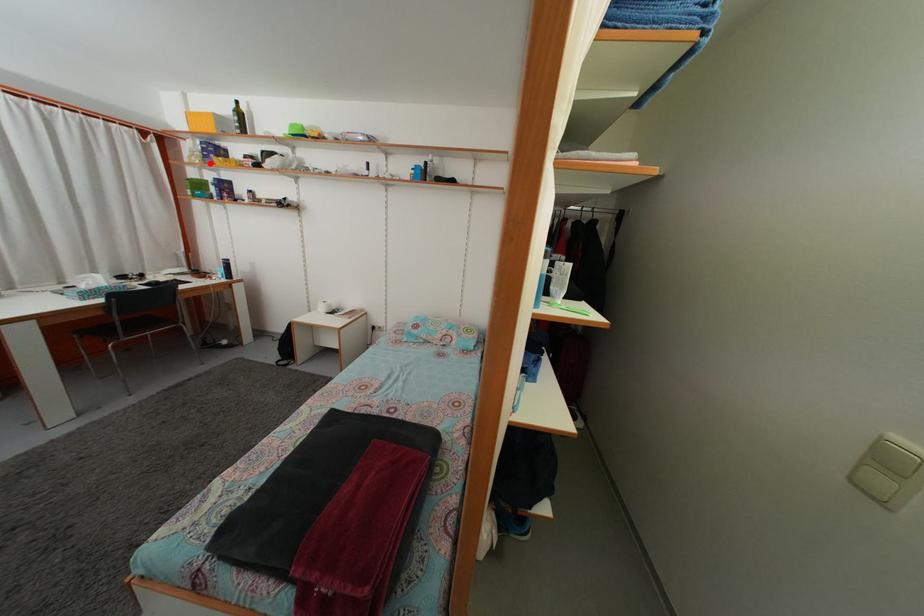
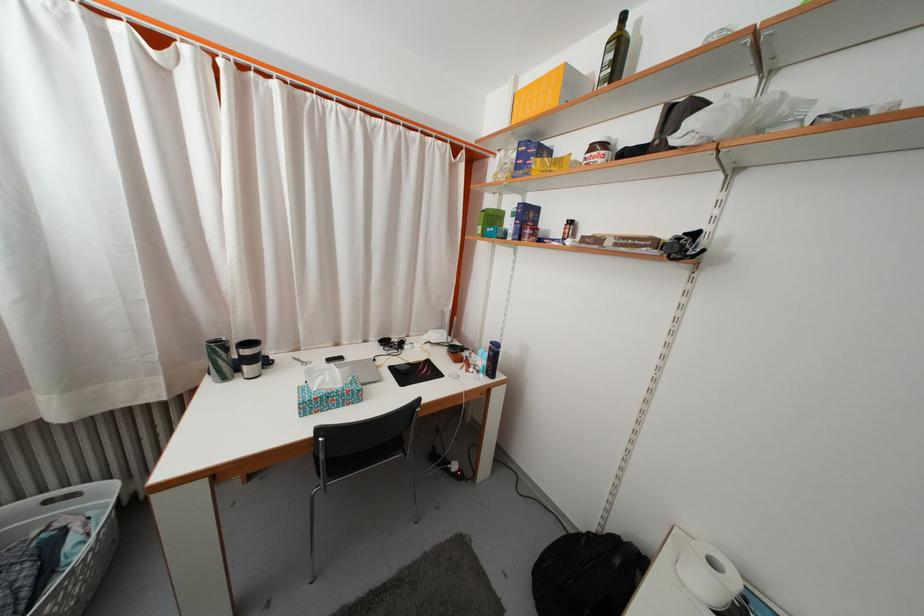
Where in the second image is the point corresponding to the highlighted location from the first image?

(523, 175)